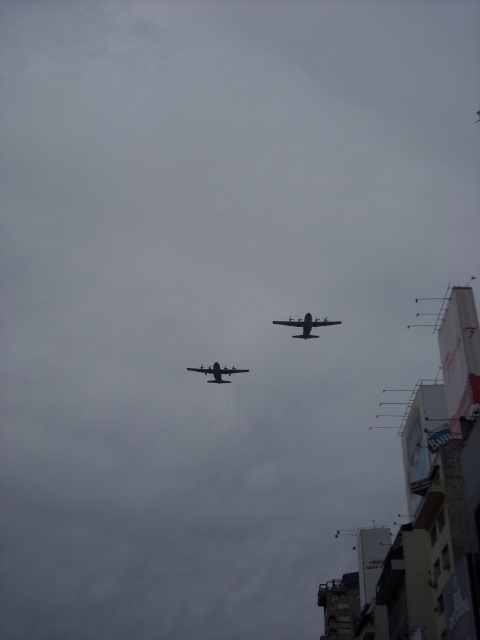
Based on the provided coordinates, where exactly is the matte black airplane at upper center located in the image?

The matte black airplane at upper center is located at coordinates point (307, 324).

Looking at this image, you are an air traffic controller observing the scene. You notice two planes in the sky. The matte black airplane at upper center and the metallic gray airplane at center. Which one is larger in size?

The matte black airplane at upper center is larger in size compared to the metallic gray airplane at center.